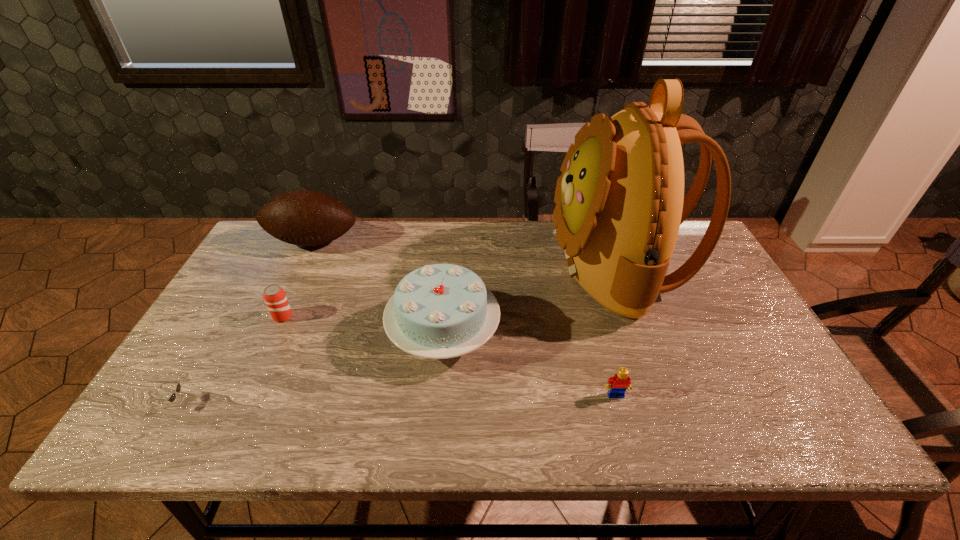
This screenshot has height=540, width=960. What are the coordinates of `the tallest object` in the screenshot? It's located at coord(620,202).

Find the location of a particular element. The image size is (960, 540). football is located at coordinates click(x=306, y=218).

You are a GUI agent. You are given a task and a screenshot of the screen. Output one action in this format:
    pyautogui.click(x=<x>, y=<y>)
    Task: Click on the third object from right to left
    Image resolution: width=960 pixels, height=540 pixels.
    Given the screenshot: What is the action you would take?
    pyautogui.click(x=440, y=311)

Where is `beer can`? This screenshot has height=540, width=960. beer can is located at coordinates (274, 296).

Find the location of `Lego`. Lego is located at coordinates (620, 382).

Find the location of a particular element. The width and height of the screenshot is (960, 540). sunglasses is located at coordinates (178, 388).

You are a GUI agent. You are given a task and a screenshot of the screen. Output one action in this format:
    pyautogui.click(x=<x>, y=<y>)
    Task: Click on the free spot located 0.290m on the front-facing side of the tallest object
    Image resolution: width=960 pixels, height=540 pixels.
    Given the screenshot: What is the action you would take?
    pyautogui.click(x=454, y=269)

Locate an element on the screen. The image size is (960, 540). free space located 0.370m on the front-facing side of the tallest object is located at coordinates (427, 269).

Identify the location of vacant region located 0.270m on the front-facing side of the tallest object. The width and height of the screenshot is (960, 540). (461, 269).

Locate an element on the screen. The height and width of the screenshot is (540, 960). free space located on the laces of the football is located at coordinates (268, 335).